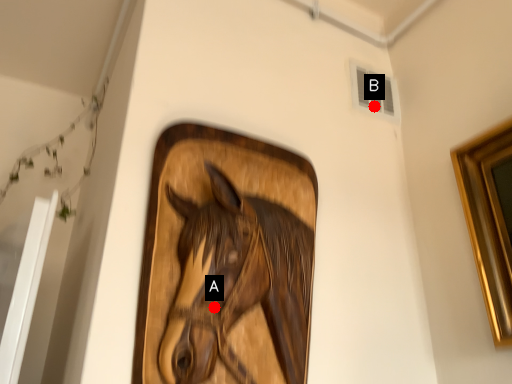
Question: Two points are circled on the image, labeled by A and B beside each circle. Which point is closer to the camera taking this photo?

Choices:
 (A) A is closer
 (B) B is closer

Answer: (A)